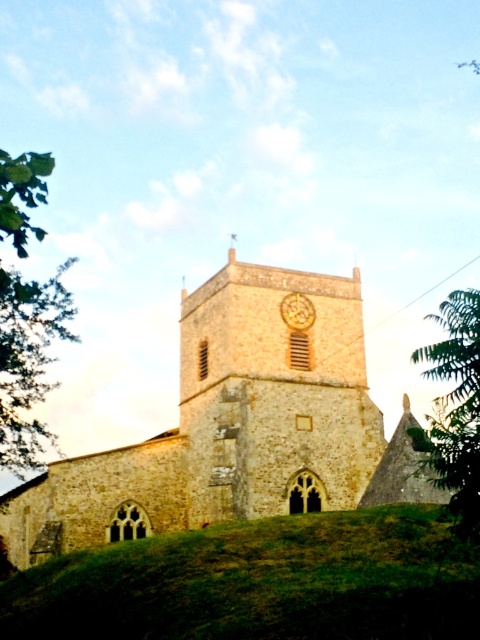
You are standing on the green grassy hill at lower center and want to climb up to the brown stone church at center. Is the church above or below your current position?

The brown stone church at center is located above the green grassy hill at lower center, so it is above your current position.

You are standing at the base of the green leafy tree at left and want to walk directly towards the stone clock tower at center. Which direction should you head?

Since the stone clock tower at center is to the right of the green leafy tree at left, you should head to the right to walk directly towards the stone clock tower at center.